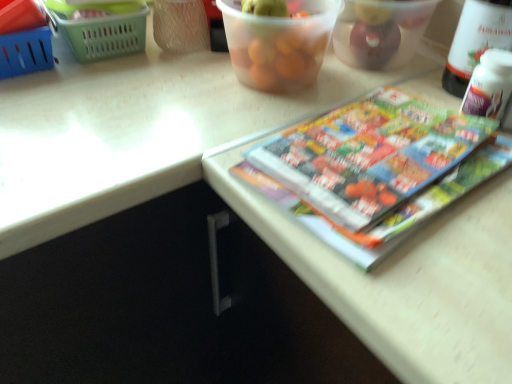
Question: Considering the relative sizes of white plastic bottle at upper right and transparent plastic container at upper center, which appears as the 2th glass bowl when viewed from the right, in the image provided, is white plastic bottle at upper right taller than transparent plastic container at upper center, which appears as the 2th glass bowl when viewed from the right,?

Choices:
 (A) yes
 (B) no

Answer: (A)

Question: Is white plastic bottle at upper right bigger than transparent plastic container at upper center, the first glass bowl in the left-to-right sequence?

Choices:
 (A) no
 (B) yes

Answer: (A)

Question: Is white plastic bottle at upper right turned away from transparent plastic container at upper center, which appears as the 2th glass bowl when viewed from the right?

Choices:
 (A) no
 (B) yes

Answer: (A)

Question: From the image's perspective, would you say white plastic bottle at upper right is shown under transparent plastic container at upper center, the first glass bowl in the left-to-right sequence?

Choices:
 (A) yes
 (B) no

Answer: (A)

Question: Is there a large distance between white plastic bottle at upper right and transparent plastic container at upper center, the first glass bowl in the left-to-right sequence?

Choices:
 (A) yes
 (B) no

Answer: (B)

Question: In the image, is multicolored glossy book at upper right on the left side or the right side of transparent plastic container at upper center, the first glass bowl in the left-to-right sequence?

Choices:
 (A) left
 (B) right

Answer: (B)

Question: Considering the positions of multicolored glossy book at upper right and transparent plastic container at upper center, the first glass bowl in the left-to-right sequence, in the image, is multicolored glossy book at upper right taller or shorter than transparent plastic container at upper center, the first glass bowl in the left-to-right sequence,?

Choices:
 (A) short
 (B) tall

Answer: (A)

Question: Based on their sizes in the image, would you say multicolored glossy book at upper right is bigger or smaller than transparent plastic container at upper center, the first glass bowl in the left-to-right sequence?

Choices:
 (A) big
 (B) small

Answer: (B)

Question: From a real-world perspective, is multicolored glossy book at upper right above or below transparent plastic container at upper center, the first glass bowl in the left-to-right sequence?

Choices:
 (A) above
 (B) below

Answer: (B)

Question: From the image's perspective, is multicolored glossy book at upper right positioned above or below white plastic bottle at upper right?

Choices:
 (A) below
 (B) above

Answer: (A)

Question: Considering the positions of multicolored glossy book at upper right and white plastic bottle at upper right in the image, is multicolored glossy book at upper right taller or shorter than white plastic bottle at upper right?

Choices:
 (A) tall
 (B) short

Answer: (B)

Question: Is point (437, 195) positioned closer to the camera than point (502, 18)?

Choices:
 (A) closer
 (B) farther

Answer: (A)

Question: Considering their positions, is multicolored glossy book at upper right located in front of or behind white plastic bottle at upper right?

Choices:
 (A) front
 (B) behind

Answer: (A)

Question: Considering the positions of blue plastic basket at upper left, the 2th basket from the right, and transparent plastic container at upper center, the first glass bowl in the left-to-right sequence, in the image, is blue plastic basket at upper left, the 2th basket from the right, bigger or smaller than transparent plastic container at upper center, the first glass bowl in the left-to-right sequence,?

Choices:
 (A) big
 (B) small

Answer: (B)

Question: Would you say blue plastic basket at upper left, acting as the first basket starting from the left, is to the left or to the right of transparent plastic container at upper center, which appears as the 2th glass bowl when viewed from the right, in the picture?

Choices:
 (A) left
 (B) right

Answer: (A)